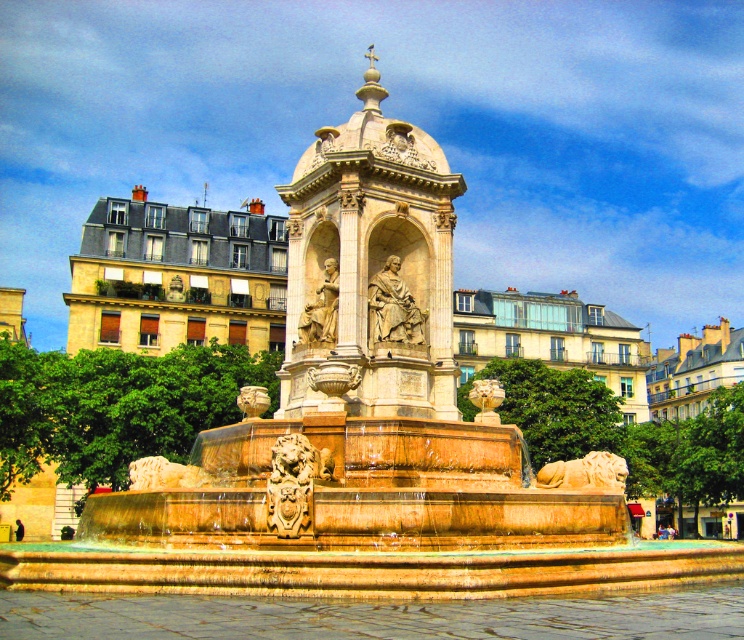
Can you confirm if stone statue at center is taller than carved stone lion at center?

Correct, stone statue at center is much taller as carved stone lion at center.

Which of these two, stone statue at center or carved stone lion at center, stands shorter?

With less height is carved stone lion at center.

Measure the distance between stone statue at center and camera.

The distance of stone statue at center from camera is 42.91 meters.

Identify the location of stone statue at center. (176, 276).

Can you confirm if stone statue at center is positioned to the right of golden stone statue at center?

Yes, stone statue at center is to the right of golden stone statue at center.

Describe the element at coordinates (176, 276) in the screenshot. I see `stone statue at center` at that location.

Where is `stone statue at center`? The width and height of the screenshot is (744, 640). stone statue at center is located at coordinates (176, 276).

Who is more distant from viewer, (567, 460) or (490, 417)?

The point (567, 460) is behind.

Is golden stone lion at lower center thinner than gold polished lion at center?

Incorrect, golden stone lion at lower center's width is not less than gold polished lion at center's.

Which is behind, point (577, 472) or point (478, 381)?

The point (478, 381) is more distant.

Find the location of `golden stone lion at lower center`. golden stone lion at lower center is located at coordinates (583, 472).